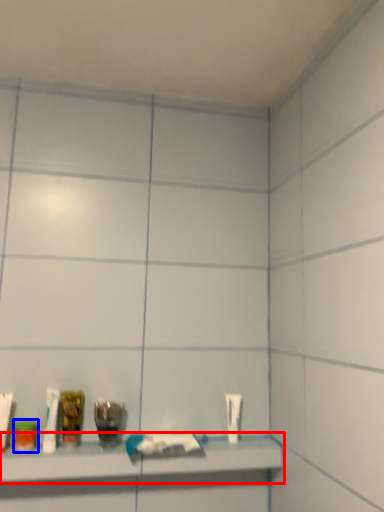
Question: Which object is closer to the camera taking this photo, shelf (highlighted by a red box) or mouthwash (highlighted by a blue box)?

Choices:
 (A) shelf
 (B) mouthwash

Answer: (A)